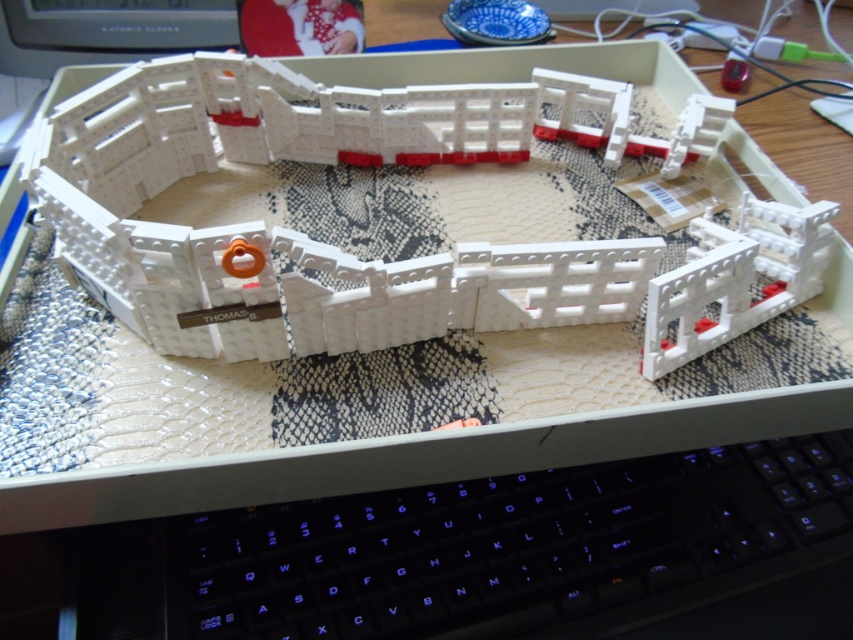
Question: Is white plastic toy at center smaller than white plastic bridge at center-right?

Choices:
 (A) yes
 (B) no

Answer: (B)

Question: Does black plastic keyboard at lower center have a lesser width compared to white plastic bridge at center-right?

Choices:
 (A) yes
 (B) no

Answer: (B)

Question: Among these objects, which one is farthest from the camera?

Choices:
 (A) white plastic bridge at center-right
 (B) white plastic toy at center

Answer: (A)

Question: Among these points, which one is farthest from the camera?

Choices:
 (A) (846, 620)
 (B) (795, 216)

Answer: (B)

Question: Can you confirm if black plastic keyboard at lower center is smaller than white plastic bridge at center-right?

Choices:
 (A) yes
 (B) no

Answer: (B)

Question: Which of the following is the farthest from the observer?

Choices:
 (A) (653, 602)
 (B) (699, 298)

Answer: (A)